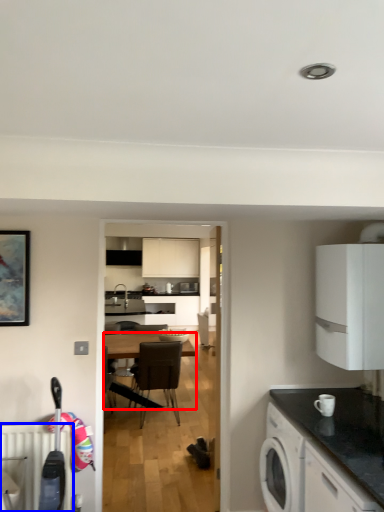
Question: Among these objects, which one is nearest to the camera, desk (highlighted by a red box) or radiator (highlighted by a blue box)?

Choices:
 (A) desk
 (B) radiator

Answer: (B)